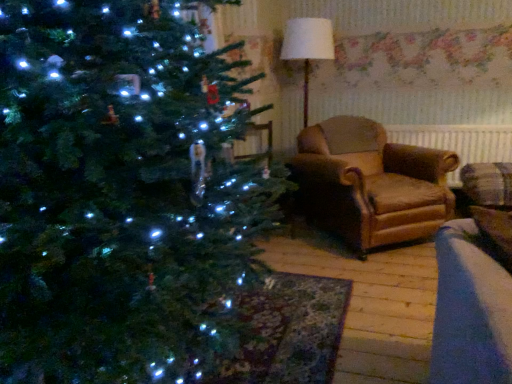
Question: In terms of width, does brown fabric radiator at right look wider or thinner when compared to leather armchair at center?

Choices:
 (A) thin
 (B) wide

Answer: (A)

Question: Is brown fabric radiator at right spatially inside leather armchair at center, or outside of it?

Choices:
 (A) inside
 (B) outside

Answer: (B)

Question: Estimate the real-world distances between objects in this image. Which object is farther from the white fabric lampshade at upper center?

Choices:
 (A) leather armchair at center
 (B) brown fabric radiator at right

Answer: (B)

Question: Which of these objects is positioned farthest from the leather armchair at center?

Choices:
 (A) white fabric lampshade at upper center
 (B) brown fabric radiator at right

Answer: (A)